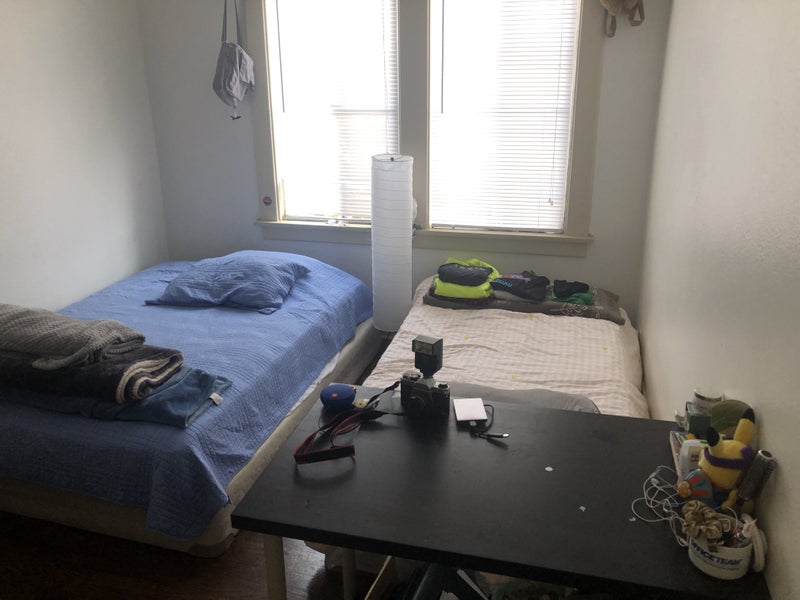
The height and width of the screenshot is (600, 800). I want to click on blankets, so pyautogui.click(x=80, y=346), pyautogui.click(x=102, y=365), pyautogui.click(x=178, y=399).